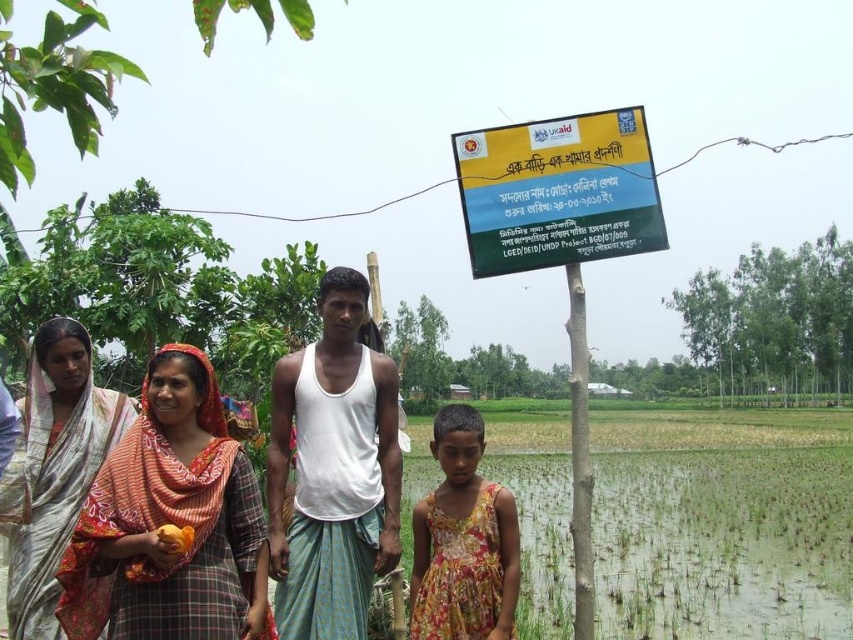
Describe the element at coordinates (235, 502) in the screenshot. I see `white cotton saree at center` at that location.

Does white cotton saree at center appear under silky silver saree at left?

Correct, white cotton saree at center is located below silky silver saree at left.

Who is more forward, (210, 381) or (59, 540)?

Point (210, 381)

In order to click on white cotton saree at center in this screenshot , I will do `click(235, 502)`.

Between white cotton tank top at center and yellow-green plastic sign at upper center, which one has more height?

With more height is white cotton tank top at center.

Which is more to the left, white cotton tank top at center or yellow-green plastic sign at upper center?

white cotton tank top at center

Locate an element on the screen. The height and width of the screenshot is (640, 853). white cotton tank top at center is located at coordinates (334, 472).

Can you confirm if yellow-green plastic sign at upper center is wider than floral fabric dress at center?

Indeed, yellow-green plastic sign at upper center has a greater width compared to floral fabric dress at center.

Does point (610, 176) come behind point (485, 497)?

Yes, it is.

Who is more distant from viewer, (x=537, y=205) or (x=508, y=516)?

Point (x=537, y=205)

At what (x,y) coordinates should I click in order to perform the action: click on yellow-green plastic sign at upper center. Please return your answer as a coordinate pair (x, y). This screenshot has width=853, height=640. Looking at the image, I should click on pos(558,192).